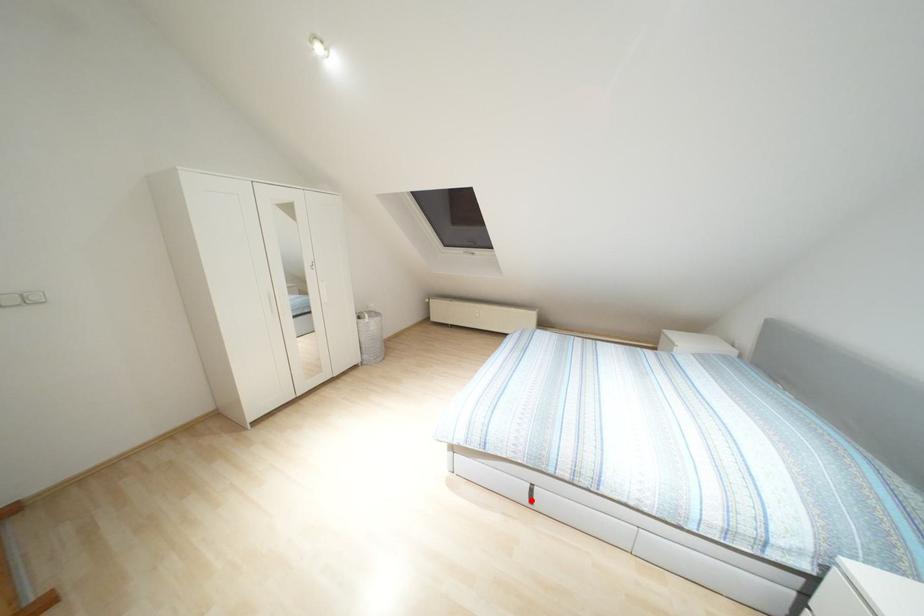
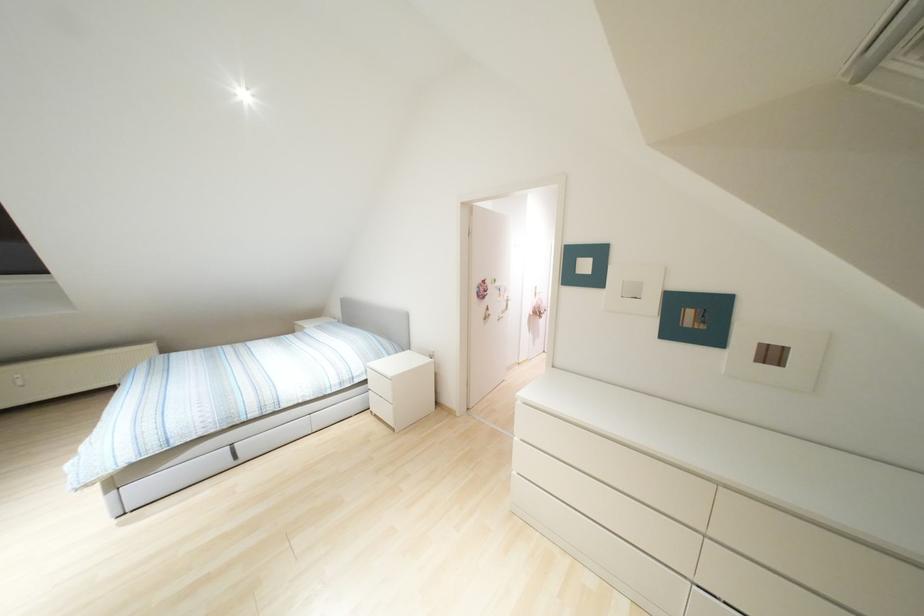
Question: I am providing you with two images of the same scene from different viewpoints. Image1 has a red point marked. In image2, the corresponding 3D location appears at what relative position? Reply with the corresponding letter.

Choices:
 (A) Closer
 (B) Farther

Answer: (A)